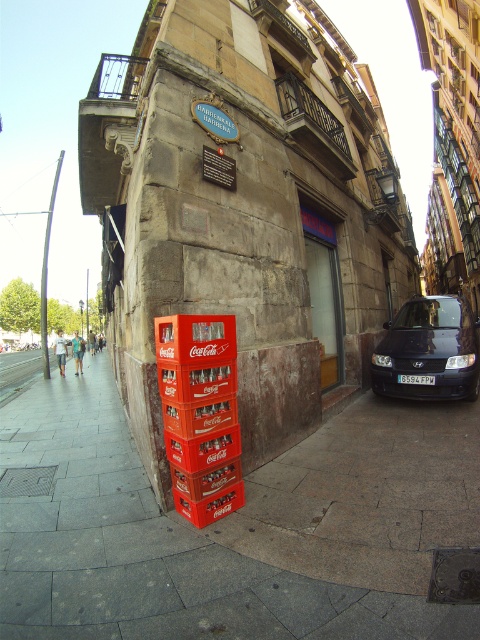
You are a delivery person who needs to park your van on the smooth concrete pavement at lower center. However, there is a dark blue metallic car at right currently occupying the area. Can you park your van there without moving the car?

The smooth concrete pavement at lower center is positioned under the dark blue metallic car at right, meaning the car is already parked there. Therefore, you cannot park your van there without moving the car.

You are standing at the street corner scene in front of the BARRENKALE BARRENA building. You need to place a small potted plant exactly at the point where the smooth concrete pavement at lower center is located. What are the coordinates of this location?

The coordinates of the smooth concrete pavement at lower center are at point (x=236, y=528).